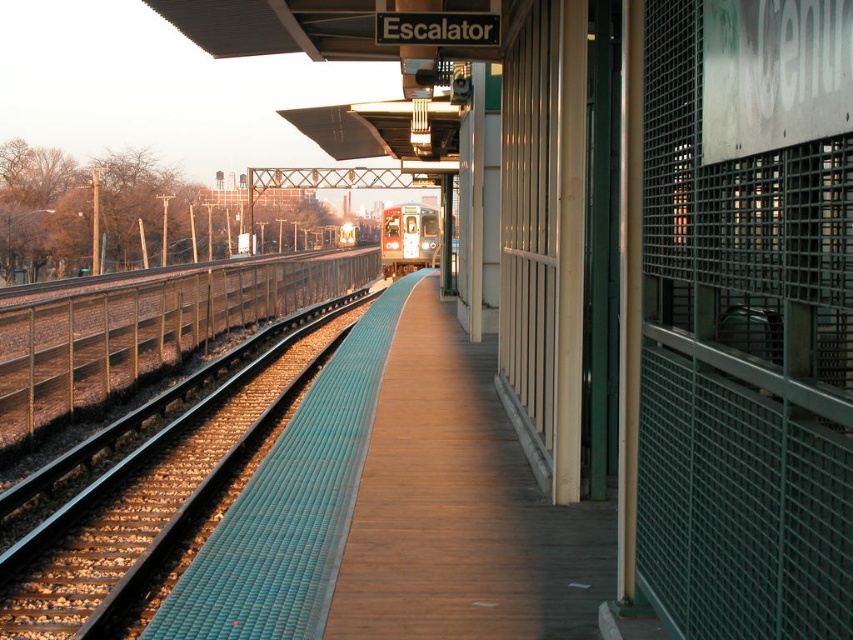
You are a construction worker assigned to place a new safety marker on the teal rubber track at center. According to the coordinates provided, where exactly should you place the marker?

The teal rubber track at center should have the safety marker placed at point (144, 493) as per the coordinates given.